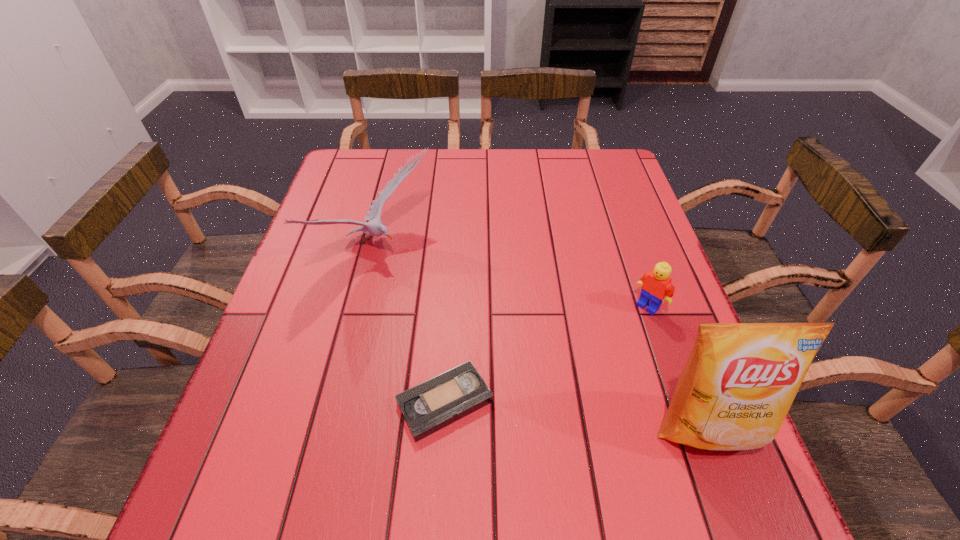
Locate an element on the screen. The image size is (960, 540). vacant spot on the desktop that is between the videotape and the crisp (potato chip) and is positioned at the tip of the beak of the farthest object is located at coordinates (x=609, y=418).

This screenshot has height=540, width=960. In order to click on free space on the desktop that is between the videotape and the tallest object and is positioned on the front-facing side of the second farthest object in this screenshot , I will do `click(544, 411)`.